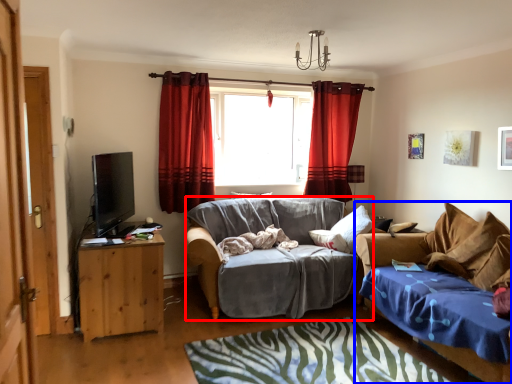
Question: Among these objects, which one is farthest to the camera, studio couch (highlighted by a red box) or studio couch (highlighted by a blue box)?

Choices:
 (A) studio couch
 (B) studio couch

Answer: (A)